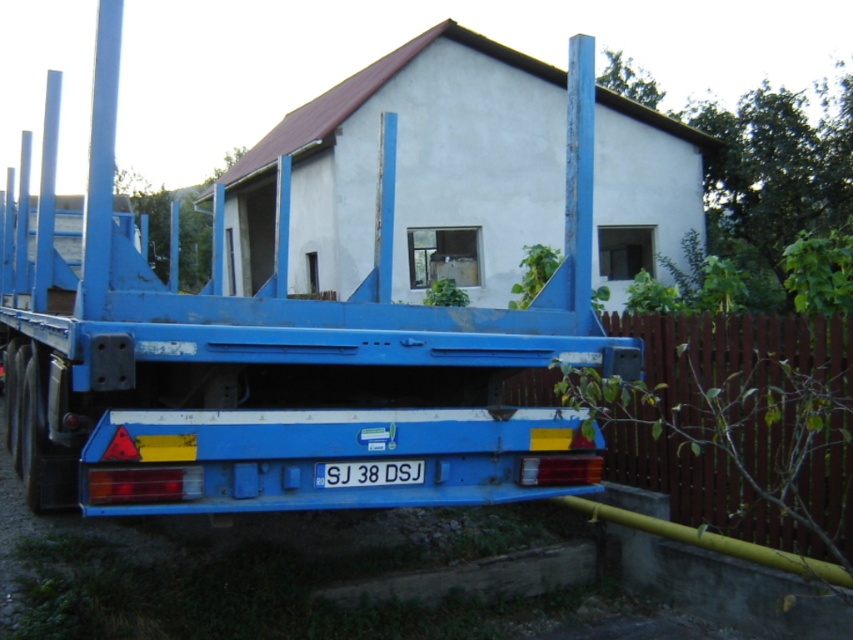
Question: Among these points, which one is nearest to the camera?

Choices:
 (A) (613, 324)
 (B) (328, 481)

Answer: (B)

Question: Is blue metallic trailer truck at center further to camera compared to white plastic license plate at center?

Choices:
 (A) yes
 (B) no

Answer: (B)

Question: Which of the following is the farthest from the observer?

Choices:
 (A) white plastic license plate at center
 (B) blue metallic trailer truck at center

Answer: (A)

Question: Does blue metallic trailer truck at center appear on the right side of brown wooden fence at right?

Choices:
 (A) no
 (B) yes

Answer: (A)

Question: Is blue metallic trailer truck at center smaller than brown wooden fence at right?

Choices:
 (A) yes
 (B) no

Answer: (A)

Question: Based on their relative distances, which object is nearer to the white plastic license plate at center?

Choices:
 (A) brown wooden fence at right
 (B) blue metallic trailer truck at center

Answer: (B)